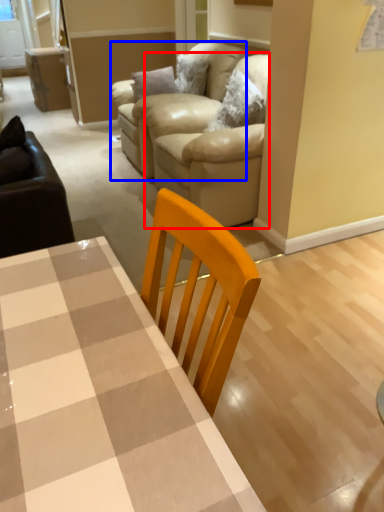
Question: Among these objects, which one is nearest to the camera, couch (highlighted by a red box) or armchair (highlighted by a blue box)?

Choices:
 (A) couch
 (B) armchair

Answer: (A)